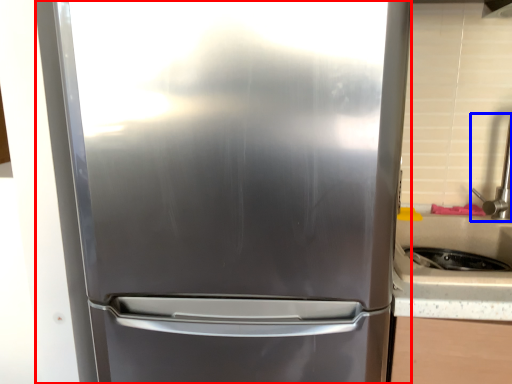
Question: Which of the following is the farthest to the observer, refrigerator (highlighted by a red box) or faucet (highlighted by a blue box)?

Choices:
 (A) refrigerator
 (B) faucet

Answer: (B)